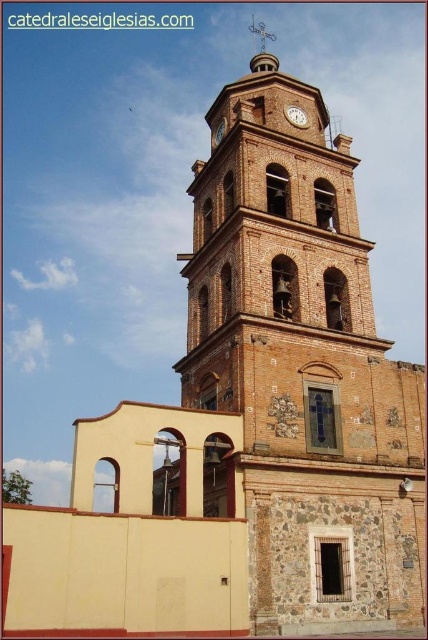
Question: Does polished copper cross at center top have a greater width compared to matte brown clock at center?

Choices:
 (A) no
 (B) yes

Answer: (B)

Question: Which of the following is the farthest from the observer?

Choices:
 (A) matte brown clock at upper center
 (B) polished copper cross at center top

Answer: (B)

Question: Which point is farther to the camera?

Choices:
 (A) matte brown clock at upper center
 (B) matte brown clock at center

Answer: (B)

Question: Considering the real-world distances, which object is farthest from the matte brown clock at center?

Choices:
 (A) matte brown clock at upper center
 (B) polished copper cross at center top

Answer: (B)

Question: Is matte brown clock at upper center further to camera compared to matte brown clock at center?

Choices:
 (A) no
 (B) yes

Answer: (A)

Question: Observing the image, what is the correct spatial positioning of matte brown clock at upper center in reference to matte brown clock at center?

Choices:
 (A) below
 (B) above

Answer: (B)